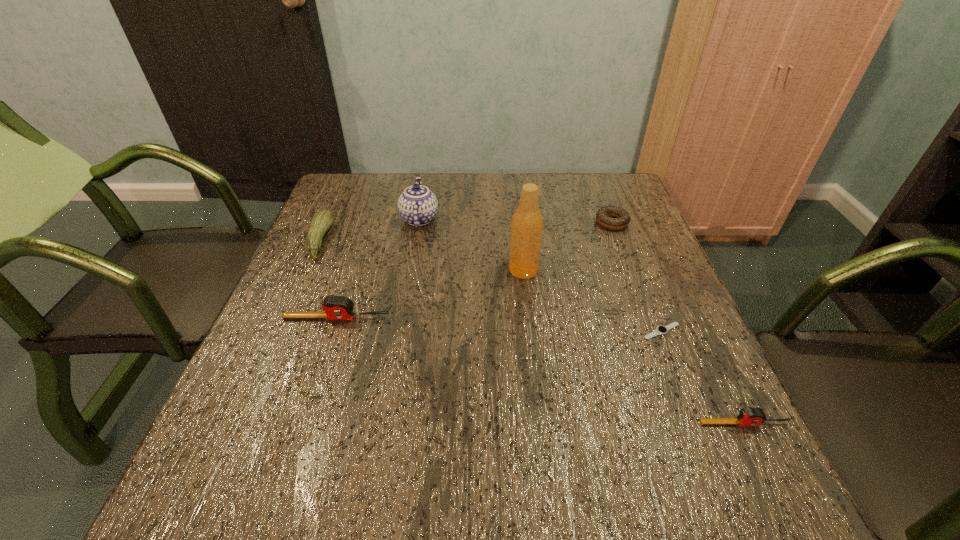
This screenshot has width=960, height=540. In order to click on blank space that satisfies the following two spatial constraints: 1. at the spout of the doughnut; 2. on the right side of the sixth shortest object in this screenshot , I will do `click(419, 222)`.

The width and height of the screenshot is (960, 540). Find the location of `vacant space that satisfies the following two spatial constraints: 1. at the stem end of the nearest object; 2. on the left side of the zucchini`. vacant space that satisfies the following two spatial constraints: 1. at the stem end of the nearest object; 2. on the left side of the zucchini is located at coordinates (239, 423).